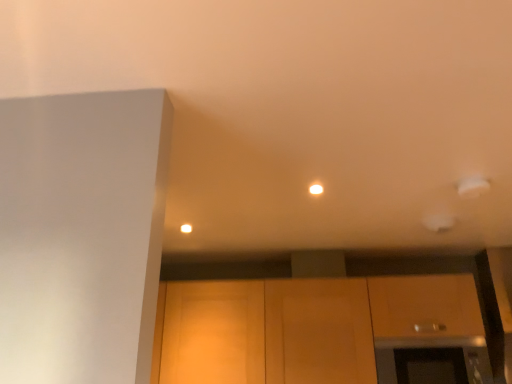
Question: Does matte wood cabinetry at lower center have a larger size compared to black glass oven at lower right?

Choices:
 (A) yes
 (B) no

Answer: (A)

Question: Does matte wood cabinetry at lower center have a lesser height compared to black glass oven at lower right?

Choices:
 (A) yes
 (B) no

Answer: (B)

Question: Does matte wood cabinetry at lower center lie in front of black glass oven at lower right?

Choices:
 (A) no
 (B) yes

Answer: (A)

Question: Considering the relative sizes of matte wood cabinetry at lower center and black glass oven at lower right in the image provided, is matte wood cabinetry at lower center thinner than black glass oven at lower right?

Choices:
 (A) no
 (B) yes

Answer: (A)

Question: Is black glass oven at lower right completely or partially inside matte wood cabinetry at lower center?

Choices:
 (A) no
 (B) yes

Answer: (B)

Question: From a real-world perspective, is matte wood cabinetry at lower center physically below black glass oven at lower right?

Choices:
 (A) no
 (B) yes

Answer: (A)

Question: Is black glass oven at lower right in contact with matte wood cabinetry at lower center?

Choices:
 (A) no
 (B) yes

Answer: (A)

Question: From the image's perspective, is black glass oven at lower right below matte wood cabinetry at lower center?

Choices:
 (A) yes
 (B) no

Answer: (A)

Question: From a real-world perspective, is black glass oven at lower right over matte wood cabinetry at lower center?

Choices:
 (A) yes
 (B) no

Answer: (B)

Question: Can you confirm if black glass oven at lower right is thinner than matte wood cabinetry at lower center?

Choices:
 (A) no
 (B) yes

Answer: (B)

Question: Can you confirm if black glass oven at lower right is smaller than matte wood cabinetry at lower center?

Choices:
 (A) yes
 (B) no

Answer: (A)

Question: Is black glass oven at lower right facing away from matte wood cabinetry at lower center?

Choices:
 (A) no
 (B) yes

Answer: (B)

Question: Considering the relative positions of black glass oven at lower right and matte wood cabinetry at lower center in the image provided, is black glass oven at lower right to the left or to the right of matte wood cabinetry at lower center?

Choices:
 (A) left
 (B) right

Answer: (B)